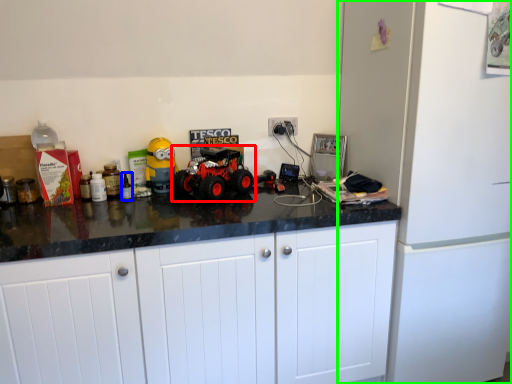
Question: Which object is positioned farthest from land vehicle (highlighted by a red box)? Select from bottle (highlighted by a blue box) and refrigerator (highlighted by a green box).

Choices:
 (A) bottle
 (B) refrigerator

Answer: (B)